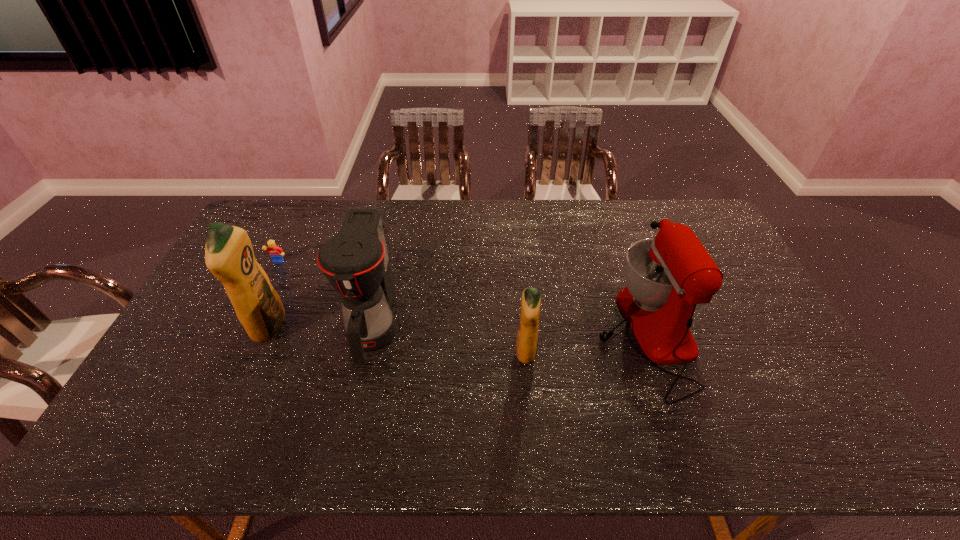
Find the location of a particular element. This screenshot has height=540, width=960. the taller detergent is located at coordinates (229, 255).

The height and width of the screenshot is (540, 960). Find the location of `the left detergent`. the left detergent is located at coordinates (229, 255).

Image resolution: width=960 pixels, height=540 pixels. I want to click on the fourth tallest object, so click(x=527, y=337).

Where is `the right detergent`? The image size is (960, 540). the right detergent is located at coordinates (527, 337).

Identify the location of control. (383, 223).

Where is `the farthest object`? The height and width of the screenshot is (540, 960). the farthest object is located at coordinates (383, 223).

The width and height of the screenshot is (960, 540). In order to click on the second shortest object in this screenshot , I will do (x=275, y=252).

Identify the location of the second farthest object. The image size is (960, 540). (275, 252).

Find the location of a particular element. Image resolution: width=960 pixels, height=540 pixels. coffee maker is located at coordinates (355, 261).

Locate an element on the screen. the rightmost object is located at coordinates pos(667,276).